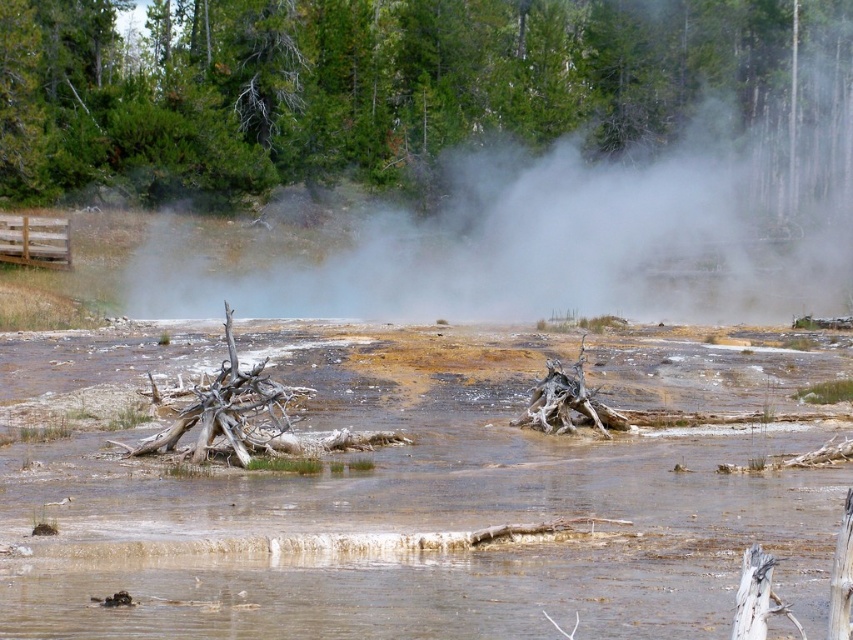
In the scene shown: You are a hiker who wants to take a photo of the white vapor at upper center. You have a camera with a zoom lens. There is a green textured tree at upper center blocking part of the vapor. Can you adjust your position to the left or right to avoid the tree?

The green textured tree at upper center is positioned on the left side of white vapor at upper center. To avoid the tree, you should move to the right side of the white vapor at upper center.

You are standing in the geothermal area and want to locate the green textured tree at upper center. Based on the coordinates provided, where should you look relative to the center of the image?

The green textured tree at upper center is located at point coordinates 0.133 on the x and 0.450 on the y axis, so you should look slightly to the left and above the center of the image.